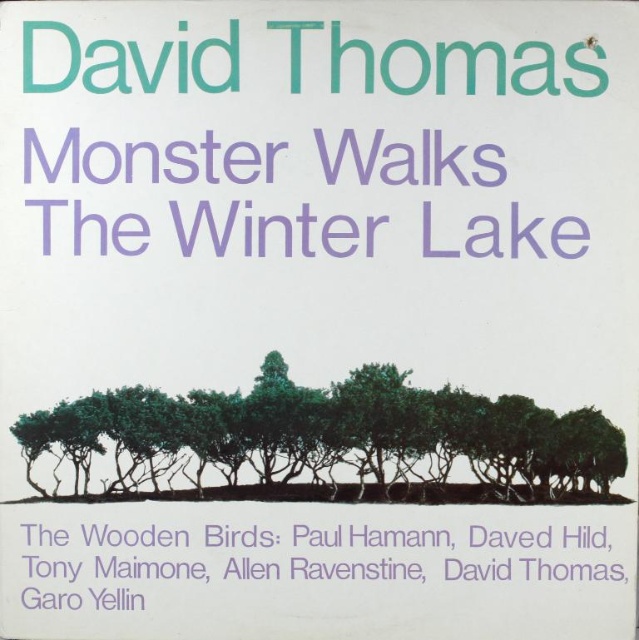
Based on the scene description, you are designing a book cover and want to ensure the text elements are appropriately sized. The cover has the purple paper text at upper center and purple paper at bottom. Which text element is bigger?

The purple paper text at upper center is larger in size than the purple paper at bottom according to the description.